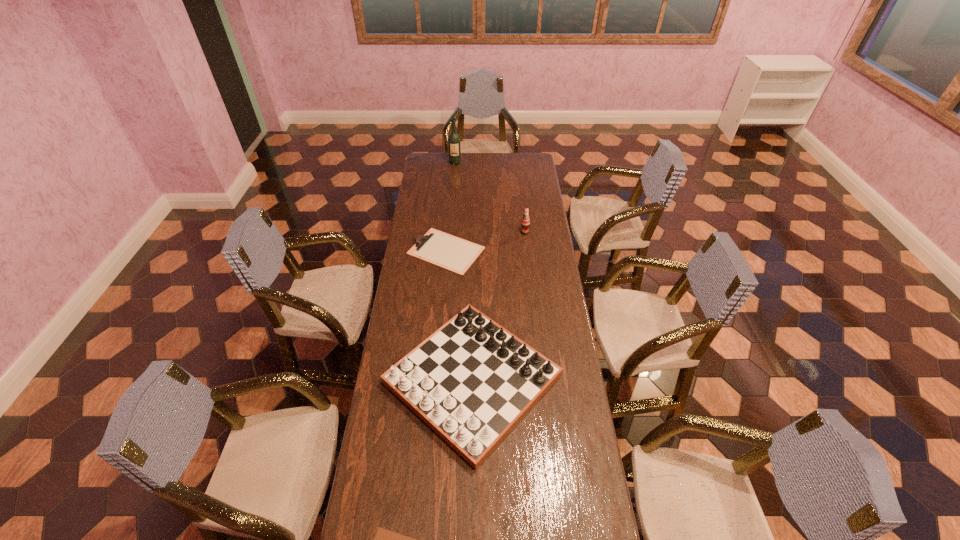
Where is `wine bottle`? This screenshot has width=960, height=540. wine bottle is located at coordinates [454, 140].

You are a GUI agent. You are given a task and a screenshot of the screen. Output one action in this format:
    pyautogui.click(x=<x>, y=<y>)
    Task: Click on the tallest object
    Image resolution: width=960 pixels, height=540 pixels.
    Given the screenshot: What is the action you would take?
    pyautogui.click(x=454, y=140)

The width and height of the screenshot is (960, 540). I want to click on soda, so click(x=525, y=222).

I want to click on gameboard, so click(x=472, y=381).

Find the location of a particular element. This screenshot has width=960, height=540. the taller clipboard is located at coordinates (447, 251).

The height and width of the screenshot is (540, 960). What are the coordinates of `the fourth tallest object` in the screenshot? It's located at (447, 251).

I want to click on vacant space located 0.400m on the labeled side of the tallest object, so click(452, 203).

Locate an element on the screen. The width and height of the screenshot is (960, 540). vacant area situated on the back of the soda is located at coordinates (522, 207).

Identify the location of vacant space situated on the back of the gameboard. The height and width of the screenshot is (540, 960). (474, 278).

Locate an element on the screen. vacant space located on the right of the taller clipboard is located at coordinates (501, 251).